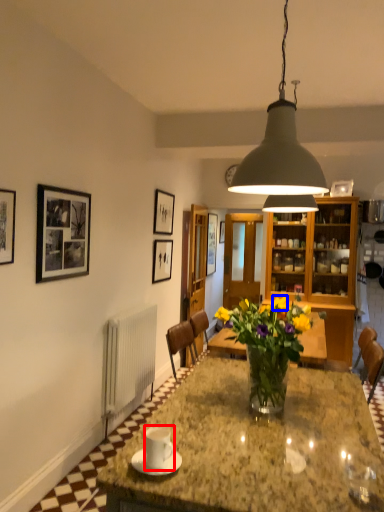
Question: Among these objects, which one is farthest to the camera, coffee cup (highlighted by a red box) or flower (highlighted by a blue box)?

Choices:
 (A) coffee cup
 (B) flower

Answer: (B)